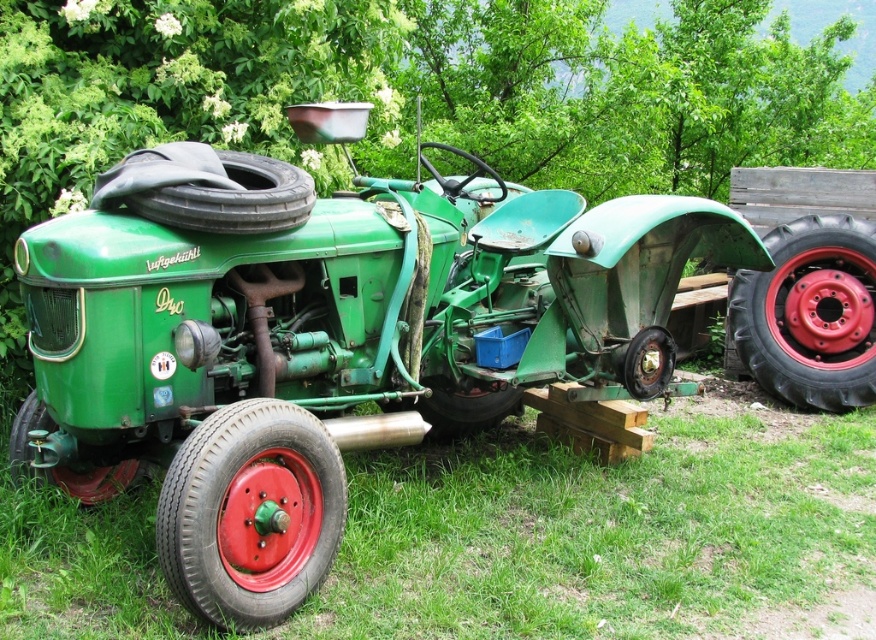
From the picture: Who is shorter, green grass at lower left or red rubber tire at lower center?

red rubber tire at lower center is shorter.

In the scene shown: Between green grass at lower left and red rubber tire at lower center, which one appears on the right side from the viewer's perspective?

green grass at lower left

Is point (705, 534) positioned behind point (496, 417)?

No, it is in front of (496, 417).

Where is `green grass at lower left`? Image resolution: width=876 pixels, height=640 pixels. green grass at lower left is located at coordinates (599, 531).

Does black rubber tire at center lie behind red rubber tire at lower center?

No.

What do you see at coordinates (232, 198) in the screenshot? I see `black rubber tire at center` at bounding box center [232, 198].

I want to click on black rubber tire at center, so click(x=232, y=198).

Which is more to the left, rubber/tire at right or black rubber tire at center?

black rubber tire at center

Which is above, rubber/tire at right or black rubber tire at center?

black rubber tire at center is above.

Image resolution: width=876 pixels, height=640 pixels. In order to click on rubber/tire at right in this screenshot , I will do `click(810, 314)`.

What are the coordinates of `rubber/tire at right` in the screenshot? It's located at (810, 314).